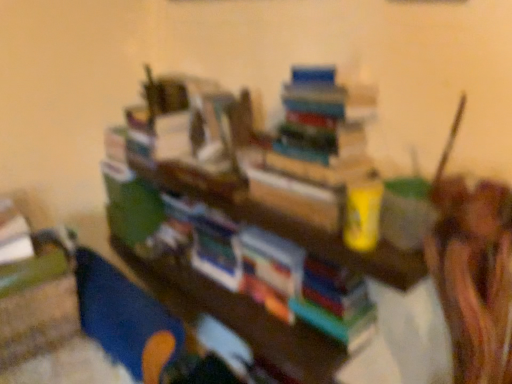
This screenshot has height=384, width=512. In order to click on hardcover books at upper center in this screenshot , I will do `click(314, 148)`.

What do you see at coordinates (314, 148) in the screenshot?
I see `hardcover books at upper center` at bounding box center [314, 148].

You are a GUI agent. You are given a task and a screenshot of the screen. Output one action in this format:
    pyautogui.click(x=<x>, y=<y>)
    Task: Click on the blue plastic toy at lower left
    The image size is (512, 384).
    Given the screenshot: What is the action you would take?
    pyautogui.click(x=34, y=284)

Image resolution: width=512 pixels, height=384 pixels. What do you see at coordinates (34, 284) in the screenshot? I see `blue plastic toy at lower left` at bounding box center [34, 284].

Where is `hardcover books at upper center`? This screenshot has height=384, width=512. hardcover books at upper center is located at coordinates (314, 148).

Which is more to the right, blue plastic toy at lower left or hardcover books at upper center?

hardcover books at upper center is more to the right.

Considering their positions, is blue plastic toy at lower left located in front of or behind hardcover books at upper center?

blue plastic toy at lower left is positioned farther from the viewer than hardcover books at upper center.

Considering the points (30, 275) and (305, 181), which point is in front, point (30, 275) or point (305, 181)?

The point (305, 181) is closer.

From the image's perspective, who appears lower, blue plastic toy at lower left or hardcover books at upper center?

blue plastic toy at lower left.

From a real-world perspective, is blue plastic toy at lower left above or below hardcover books at upper center?

blue plastic toy at lower left is situated lower than hardcover books at upper center in the real world.

From the picture: Does blue plastic toy at lower left have a lesser width compared to hardcover books at upper center?

Incorrect, the width of blue plastic toy at lower left is not less than that of hardcover books at upper center.

Does blue plastic toy at lower left have a greater height compared to hardcover books at upper center?

Correct, blue plastic toy at lower left is much taller as hardcover books at upper center.

Looking at this image, which of these two, blue plastic toy at lower left or hardcover books at upper center, is smaller?

Smaller between the two is hardcover books at upper center.

Is blue plastic toy at lower left inside the boundaries of hardcover books at upper center, or outside?

blue plastic toy at lower left is not enclosed by hardcover books at upper center.

Are blue plastic toy at lower left and hardcover books at upper center far apart?

Actually, blue plastic toy at lower left and hardcover books at upper center are a little close together.

Does blue plastic toy at lower left turn towards hardcover books at upper center?

No, blue plastic toy at lower left is not aimed at hardcover books at upper center.

Can you tell me how much blue plastic toy at lower left and hardcover books at upper center differ in facing direction?

blue plastic toy at lower left and hardcover books at upper center are facing 89.4 degrees away from each other.

Locate an element on the screen. shelf on the left side of hardcover books at upper center is located at coordinates (34, 284).

Is hardcover books at upper center to the right of blue plastic toy at lower left from the viewer's perspective?

Yes.

Which object is closer to the camera, hardcover books at upper center or blue plastic toy at lower left?

Positioned in front is hardcover books at upper center.

Which point is more distant from viewer, (285, 97) or (54, 254)?

The point (54, 254) is farther.

From the image's perspective, is hardcover books at upper center located beneath blue plastic toy at lower left?

No.

From a real-world perspective, is hardcover books at upper center below blue plastic toy at lower left?

Actually, hardcover books at upper center is physically above blue plastic toy at lower left in the real world.

Looking at this image, can you confirm if hardcover books at upper center is wider than blue plastic toy at lower left?

No, hardcover books at upper center is not wider than blue plastic toy at lower left.

Does hardcover books at upper center have a greater height compared to blue plastic toy at lower left?

Incorrect, the height of hardcover books at upper center is not larger of that of blue plastic toy at lower left.

Who is smaller, hardcover books at upper center or blue plastic toy at lower left?

hardcover books at upper center.

Is hardcover books at upper center situated inside blue plastic toy at lower left or outside?

hardcover books at upper center cannot be found inside blue plastic toy at lower left.

Is there a large distance between hardcover books at upper center and blue plastic toy at lower left?

No.

Is hardcover books at upper center oriented towards blue plastic toy at lower left?

No, hardcover books at upper center is not oriented towards blue plastic toy at lower left.

Locate an element on the screen. Image resolution: width=512 pixels, height=384 pixels. book lying in front of the blue plastic toy at lower left is located at coordinates (314, 148).

At what (x,y) coordinates should I click in order to perform the action: click on book located in front of the blue plastic toy at lower left. Please return your answer as a coordinate pair (x, y). Looking at the image, I should click on (314, 148).

Where is `book that appears above the blue plastic toy at lower left (from the image's perspective)`? This screenshot has height=384, width=512. book that appears above the blue plastic toy at lower left (from the image's perspective) is located at coordinates (314, 148).